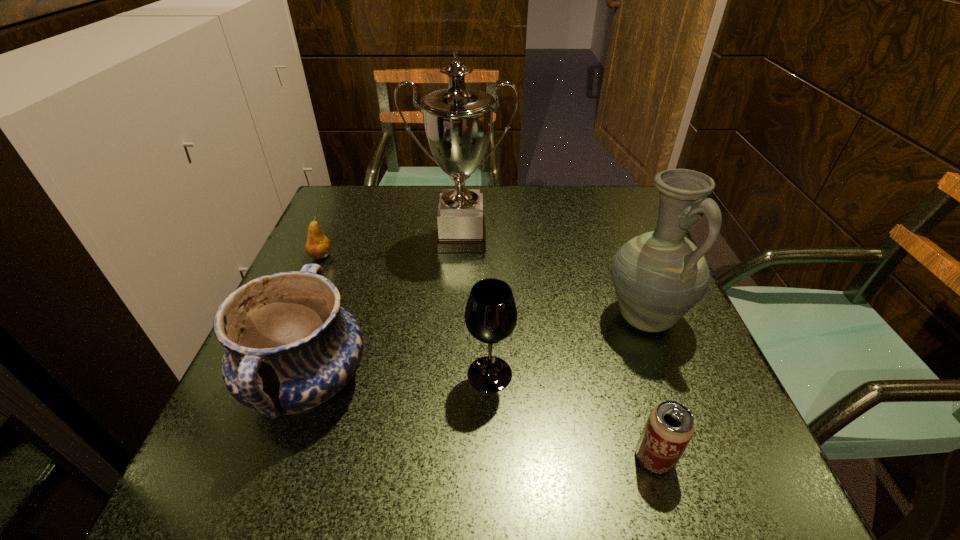
This screenshot has height=540, width=960. In order to click on free space located on the right of the pear in this screenshot , I will do `click(431, 256)`.

Identify the location of vacant space situated 0.060m on the left of the beer can. This screenshot has width=960, height=540. (594, 458).

Locate an element on the screen. object at the far edge is located at coordinates (458, 121).

Where is `pottery that is at the near edge`? Image resolution: width=960 pixels, height=540 pixels. pottery that is at the near edge is located at coordinates (290, 346).

Image resolution: width=960 pixels, height=540 pixels. In order to click on beer can at the near edge in this screenshot , I will do `click(670, 426)`.

Locate an element on the screen. This screenshot has height=540, width=960. pottery that is at the left edge is located at coordinates (290, 346).

Locate an element on the screen. pear that is at the left edge is located at coordinates (318, 246).

The height and width of the screenshot is (540, 960). I want to click on pitcher at the right edge, so click(x=658, y=276).

At what (x,y) coordinates should I click in order to perform the action: click on beer can present at the right edge. Please return your answer as a coordinate pair (x, y). This screenshot has height=540, width=960. Looking at the image, I should click on (670, 426).

The width and height of the screenshot is (960, 540). In order to click on object that is at the near left corner in this screenshot , I will do (x=290, y=346).